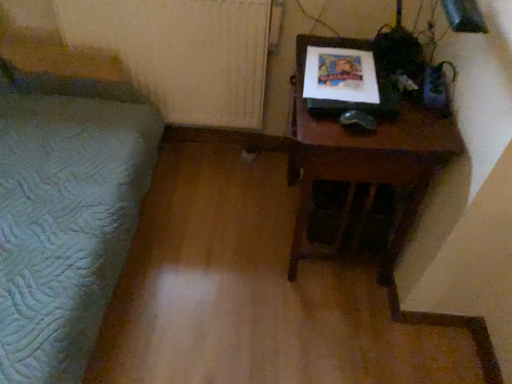
At what (x,y) coordinates should I click in order to perform the action: click on green quilted bedspread at left. Please return your answer as a coordinate pair (x, y). The width and height of the screenshot is (512, 384). Looking at the image, I should click on 65,214.

Measure the distance between point (x=242, y=119) and camera.

Point (x=242, y=119) and camera are 6.35 feet apart from each other.

Where is `green quilted bedspread at left`? green quilted bedspread at left is located at coordinates (65, 214).

Considering the relative positions of green quilted bedspread at left and white textured radiator at upper left in the image provided, is green quilted bedspread at left to the left or to the right of white textured radiator at upper left?

In the image, green quilted bedspread at left appears on the left side of white textured radiator at upper left.

Which object is closer to the camera, green quilted bedspread at left or white textured radiator at upper left?

green quilted bedspread at left.

Based on the photo, is green quilted bedspread at left taller than white textured radiator at upper left?

Indeed, green quilted bedspread at left has a greater height compared to white textured radiator at upper left.

From the picture: Is white textured radiator at upper left completely or partially inside green quilted bedspread at left?

No, white textured radiator at upper left is not a part of green quilted bedspread at left.

From the image's perspective, is wooden table at right over white textured radiator at upper left?

No, from the image's perspective, wooden table at right is not over white textured radiator at upper left.

From a real-world perspective, which is physically above, wooden table at right or white textured radiator at upper left?

In real-world perspective, white textured radiator at upper left is above.

Is point (356, 136) positioned behind point (237, 87)?

No, (356, 136) is closer to viewer.

Is white textured radiator at upper left completely or partially outside of green quilted bedspread at left?

Absolutely, white textured radiator at upper left is external to green quilted bedspread at left.

From the image's perspective, is white textured radiator at upper left located above or below green quilted bedspread at left?

Based on their image positions, white textured radiator at upper left is located above green quilted bedspread at left.

In terms of size, does white textured radiator at upper left appear bigger or smaller than green quilted bedspread at left?

white textured radiator at upper left is smaller than green quilted bedspread at left.

Which object is closer to the camera taking this photo, white textured radiator at upper left or green quilted bedspread at left?

green quilted bedspread at left is closer to the camera.

Considering the positions of objects white textured radiator at upper left and wooden table at right in the image provided, who is more to the right, white textured radiator at upper left or wooden table at right?

Positioned to the right is wooden table at right.

Which of these two, white textured radiator at upper left or wooden table at right, stands shorter?

With less height is white textured radiator at upper left.

From a real-world perspective, which object stands above the other?

white textured radiator at upper left is physically above.

Do you think white textured radiator at upper left is within wooden table at right, or outside of it?

white textured radiator at upper left is spatially situated outside wooden table at right.

Is green quilted bedspread at left to the left or to the right of wooden table at right in the image?

In the image, green quilted bedspread at left appears on the left side of wooden table at right.

What's the angular difference between green quilted bedspread at left and wooden table at right's facing directions?

They differ by 179 degrees in their facing directions.

Who is taller, green quilted bedspread at left or wooden table at right?

green quilted bedspread at left.

Could you tell me if green quilted bedspread at left is turned towards wooden table at right?

Yes, green quilted bedspread at left is oriented towards wooden table at right.

From a real-world perspective, who is located higher, wooden table at right or green quilted bedspread at left?

In real-world perspective, green quilted bedspread at left is above.

Between wooden table at right and green quilted bedspread at left, which one has less height?

Standing shorter between the two is wooden table at right.

How many degrees apart are the facing directions of wooden table at right and green quilted bedspread at left?

179 degrees.

Can you confirm if wooden table at right is wider than green quilted bedspread at left?

No.

The width and height of the screenshot is (512, 384). I want to click on radiator on the right of green quilted bedspread at left, so click(x=182, y=52).

Where is `radiator located on the left of wooden table at right`? The width and height of the screenshot is (512, 384). radiator located on the left of wooden table at right is located at coordinates (182, 52).

When comparing their distances from white textured radiator at upper left, does wooden table at right or green quilted bedspread at left seem closer?

green quilted bedspread at left is closer to white textured radiator at upper left.

Based on their spatial positions, is green quilted bedspread at left or white textured radiator at upper left further from wooden table at right?

Based on the image, green quilted bedspread at left appears to be further to wooden table at right.

Looking at the image, which one is located further to green quilted bedspread at left, wooden table at right or white textured radiator at upper left?

wooden table at right.

Considering their positions, is white textured radiator at upper left positioned further to wooden table at right than green quilted bedspread at left?

Based on the image, green quilted bedspread at left appears to be further to wooden table at right.

When comparing their distances from white textured radiator at upper left, does green quilted bedspread at left or wooden table at right seem closer?

green quilted bedspread at left lies closer to white textured radiator at upper left than the other object.

Based on their spatial positions, is white textured radiator at upper left or wooden table at right further from green quilted bedspread at left?

The object further to green quilted bedspread at left is wooden table at right.

The height and width of the screenshot is (384, 512). Find the location of `radiator between green quilted bedspread at left and wooden table at right in the horizontal direction`. radiator between green quilted bedspread at left and wooden table at right in the horizontal direction is located at coordinates (182, 52).